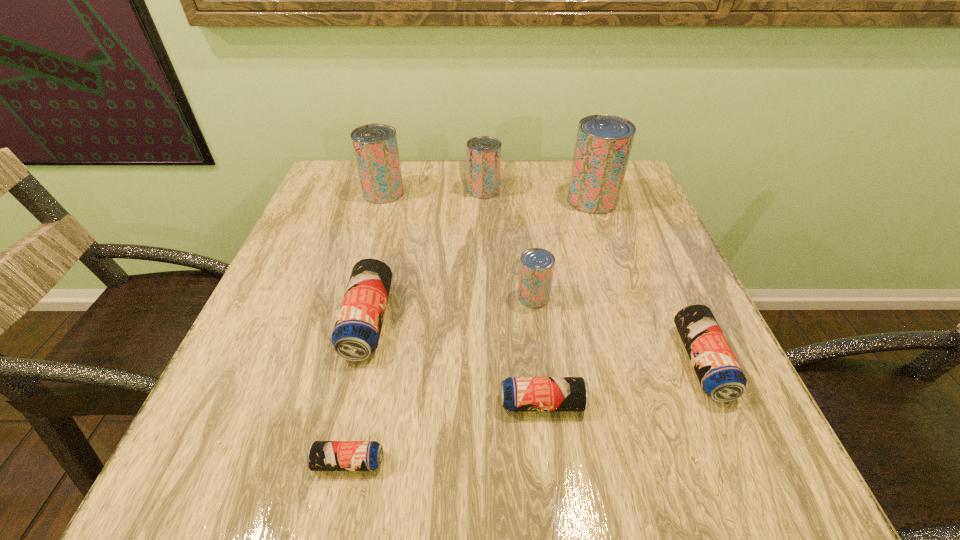
Find the location of `vacant position located 0.150m on the back of the fourth shortest beer can`. vacant position located 0.150m on the back of the fourth shortest beer can is located at coordinates (388, 239).

Where is `vacant region located on the left of the sixth tallest beer can`? vacant region located on the left of the sixth tallest beer can is located at coordinates (532, 362).

You are a GUI agent. You are given a task and a screenshot of the screen. Output one action in this format:
    pyautogui.click(x=<x>, y=<y>)
    Task: Click on the blank space located on the right of the second blue beer can from right to left
    The width and height of the screenshot is (960, 540).
    Given the screenshot: What is the action you would take?
    pyautogui.click(x=722, y=403)

The height and width of the screenshot is (540, 960). I want to click on free space located on the right of the shortest object, so pyautogui.click(x=655, y=462).

I want to click on object positioned at the near edge, so click(x=322, y=455).

Locate an element on the screen. This screenshot has height=540, width=960. object at the left edge is located at coordinates (375, 146).

Where is `object present at the far left corner`? Image resolution: width=960 pixels, height=540 pixels. object present at the far left corner is located at coordinates (375, 146).

The image size is (960, 540). What are the coordinates of `object located at the far right corner` in the screenshot? It's located at (603, 145).

The height and width of the screenshot is (540, 960). Identify the location of free point at the far edge. (541, 163).

I want to click on free space at the near edge of the desktop, so click(x=422, y=465).